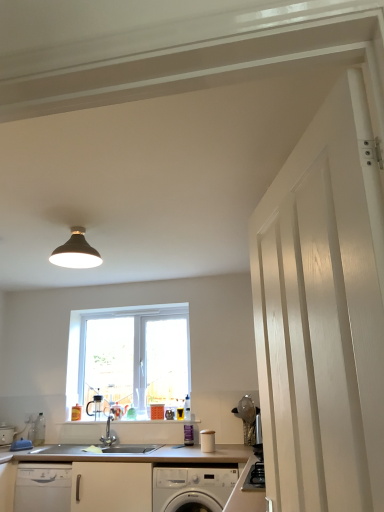
Measure the distance between point (x=115, y=488) and camera.

Point (x=115, y=488) is 2.97 meters away from camera.

What do you see at coordinates (119, 479) in the screenshot? Image resolution: width=384 pixels, height=512 pixels. I see `wooden countertop at lower left` at bounding box center [119, 479].

The width and height of the screenshot is (384, 512). Describe the element at coordinates (192, 488) in the screenshot. I see `white glossy washing machine at lower center` at that location.

You are a GUI agent. You are given a task and a screenshot of the screen. Output one action in this format:
    pyautogui.click(x=<x>, y=<y>)
    Task: Click on the matte black light fixture at upper center
    This screenshot has height=512, width=384.
    Given the screenshot: What is the action you would take?
    pyautogui.click(x=76, y=252)

Considering the positions of objects matte black light fixture at upper center and white glossy washing machine at lower center in the image provided, who is more to the left, matte black light fixture at upper center or white glossy washing machine at lower center?

matte black light fixture at upper center.

Can you tell me how much matte black light fixture at upper center and white glossy washing machine at lower center differ in facing direction?

The angular difference between matte black light fixture at upper center and white glossy washing machine at lower center is 0.0343 degrees.

Considering the relative sizes of matte black light fixture at upper center and white glossy washing machine at lower center in the image provided, is matte black light fixture at upper center shorter than white glossy washing machine at lower center?

Yes, matte black light fixture at upper center is shorter than white glossy washing machine at lower center.

Is white glossy washing machine at lower center inside matte black light fixture at upper center?

Definitely not — white glossy washing machine at lower center is not inside matte black light fixture at upper center.

Between satin nickel faucet at center and white plastic window at center, which one has smaller size?

Smaller between the two is satin nickel faucet at center.

Can we say satin nickel faucet at center lies outside white plastic window at center?

Absolutely, satin nickel faucet at center is external to white plastic window at center.

Who is shorter, satin nickel faucet at center or white plastic window at center?

Standing shorter between the two is satin nickel faucet at center.

Is satin nickel faucet at center facing towards white plastic window at center?

No, satin nickel faucet at center is not facing towards white plastic window at center.

Do you think satin nickel faucet at center is within white wood door at right, or outside of it?

satin nickel faucet at center lies outside white wood door at right.

From the image's perspective, is satin nickel faucet at center located above or below white wood door at right?

Based on their image positions, satin nickel faucet at center is located beneath white wood door at right.

Where is `tap behind the white wood door at right`? Image resolution: width=384 pixels, height=512 pixels. tap behind the white wood door at right is located at coordinates (108, 433).

Is satin nickel faucet at center facing towards white wood door at right?

No, satin nickel faucet at center does not turn towards white wood door at right.

Would you say white wood door at right contains matte black light fixture at upper center?

No, matte black light fixture at upper center is located outside of white wood door at right.

Which is more to the right, white wood door at right or matte black light fixture at upper center?

white wood door at right.

Which of these two, white wood door at right or matte black light fixture at upper center, is thinner?

white wood door at right.

Can you confirm if white wood door at right is taller than matte black light fixture at upper center?

Indeed, white wood door at right has a greater height compared to matte black light fixture at upper center.

Is wooden countertop at lower left next to white glossy washing machine at lower center?

No.

From their relative heights in the image, would you say wooden countertop at lower left is taller or shorter than white glossy washing machine at lower center?

wooden countertop at lower left is taller than white glossy washing machine at lower center.

From a real-world perspective, is wooden countertop at lower left physically located above or below white glossy washing machine at lower center?

Clearly, from a real-world perspective, wooden countertop at lower left is above white glossy washing machine at lower center.

Is point (108, 445) behind point (62, 255)?

Yes.

Measure the distance between satin nickel faucet at center and matte black light fixture at upper center.

They are 5.25 feet apart.

Consider the image. How many degrees apart are the facing directions of satin nickel faucet at center and matte black light fixture at upper center?

The angle between the facing direction of satin nickel faucet at center and the facing direction of matte black light fixture at upper center is 0.71 degrees.

Are satin nickel faucet at center and matte black light fixture at upper center making contact?

satin nickel faucet at center and matte black light fixture at upper center are clearly separated.

Consider the image. Is white plastic window at center directly adjacent to white glossy washing machine at lower center?

There is a gap between white plastic window at center and white glossy washing machine at lower center.

Between white plastic window at center and white glossy washing machine at lower center, which one has smaller size?

Smaller between the two is white plastic window at center.

Considering the relative sizes of white plastic window at center and white glossy washing machine at lower center in the image provided, is white plastic window at center taller than white glossy washing machine at lower center?

Indeed, white plastic window at center has a greater height compared to white glossy washing machine at lower center.

Which object is thinner, white plastic window at center or white glossy washing machine at lower center?

Thinner between the two is white plastic window at center.

The width and height of the screenshot is (384, 512). What are the coordinates of `home appliance behind the matte black light fixture at upper center` in the screenshot? It's located at (192, 488).

Where is `tap in front of the white plastic window at center`? The image size is (384, 512). tap in front of the white plastic window at center is located at coordinates (108, 433).

When comparing their distances from satin nickel faucet at center, does white wood door at right or white glossy washing machine at lower center seem further?

white wood door at right is positioned further to the anchor satin nickel faucet at center.

Which object lies nearer to the anchor point satin nickel faucet at center, wooden countertop at lower left or matte black light fixture at upper center?

wooden countertop at lower left is closer to satin nickel faucet at center.

When comparing their distances from wooden countertop at lower left, does white wood door at right or matte black light fixture at upper center seem further?

white wood door at right is positioned further to the anchor wooden countertop at lower left.

Looking at the image, which one is located further to white glossy washing machine at lower center, wooden countertop at lower left or white plastic window at center?

The object further to white glossy washing machine at lower center is white plastic window at center.

Considering their positions, is white wood door at right positioned further to satin nickel faucet at center than white plastic window at center?

Among the two, white wood door at right is located further to satin nickel faucet at center.

When comparing their distances from matte black light fixture at upper center, does wooden countertop at lower left or white glossy washing machine at lower center seem closer?

wooden countertop at lower left is positioned closer to the anchor matte black light fixture at upper center.

Considering their positions, is white plastic window at center positioned further to wooden countertop at lower left than matte black light fixture at upper center?

matte black light fixture at upper center.

Looking at the image, which one is located further to satin nickel faucet at center, white plastic window at center or matte black light fixture at upper center?

The object further to satin nickel faucet at center is matte black light fixture at upper center.

I want to click on countertop between white wood door at right and satin nickel faucet at center in the front-back direction, so click(x=119, y=479).

At what (x,y) coordinates should I click in order to perform the action: click on light fixture between white wood door at right and wooden countertop at lower left in the front-back direction. Please return your answer as a coordinate pair (x, y). Looking at the image, I should click on (76, 252).

The height and width of the screenshot is (512, 384). I want to click on countertop between white wood door at right and white plastic window at center in the front-back direction, so click(119, 479).

Image resolution: width=384 pixels, height=512 pixels. In order to click on light fixture between white wood door at right and white glossy washing machine at lower center in the front-back direction in this screenshot , I will do `click(76, 252)`.